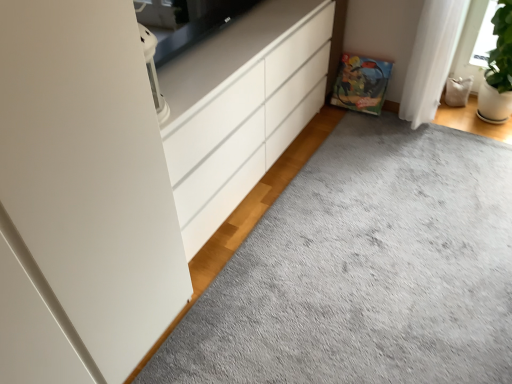
Measure the distance between white glossy chest of drawers at center and camera.

white glossy chest of drawers at center is 1.45 meters away from camera.

The height and width of the screenshot is (384, 512). What do you see at coordinates (241, 108) in the screenshot?
I see `white glossy chest of drawers at center` at bounding box center [241, 108].

Locate an element on the screen. white glossy chest of drawers at center is located at coordinates click(x=241, y=108).

What do you see at coordinates (290, 181) in the screenshot?
I see `gray soft carpet at center` at bounding box center [290, 181].

What is the approximate width of gray soft carpet at center?

gray soft carpet at center is 2.18 meters in width.

Identify the location of gray soft carpet at center. This screenshot has width=512, height=384. (290, 181).

Where is `white glossy chest of drawers at center`? The width and height of the screenshot is (512, 384). white glossy chest of drawers at center is located at coordinates (241, 108).

Based on the photo, which object is positioned more to the left, white glossy chest of drawers at center or gray soft carpet at center?

From the viewer's perspective, white glossy chest of drawers at center appears more on the left side.

Considering the relative positions of white glossy chest of drawers at center and gray soft carpet at center in the image provided, is white glossy chest of drawers at center behind gray soft carpet at center?

Yes, it is behind gray soft carpet at center.

Is point (198, 133) more distant than point (251, 199)?

No.

From the picture: From the image's perspective, which object appears higher, white glossy chest of drawers at center or gray soft carpet at center?

white glossy chest of drawers at center.

From a real-world perspective, is white glossy chest of drawers at center physically below gray soft carpet at center?

No, from a real-world perspective, white glossy chest of drawers at center is not under gray soft carpet at center.

Considering the sizes of objects white glossy chest of drawers at center and gray soft carpet at center in the image provided, who is thinner, white glossy chest of drawers at center or gray soft carpet at center?

white glossy chest of drawers at center.

Is white glossy chest of drawers at center shorter than gray soft carpet at center?

Incorrect, the height of white glossy chest of drawers at center does not fall short of that of gray soft carpet at center.

Which of these two, white glossy chest of drawers at center or gray soft carpet at center, is bigger?

Bigger between the two is white glossy chest of drawers at center.

Does white glossy chest of drawers at center contain gray soft carpet at center?

No, gray soft carpet at center is not surrounded by white glossy chest of drawers at center.

Is white glossy chest of drawers at center next to gray soft carpet at center and touching it?

No, white glossy chest of drawers at center is not with gray soft carpet at center.

Is white glossy chest of drawers at center aimed at gray soft carpet at center?

Yes, white glossy chest of drawers at center is turned towards gray soft carpet at center.

How many degrees apart are the facing directions of white glossy chest of drawers at center and gray soft carpet at center?

90.4 degrees.

The height and width of the screenshot is (384, 512). I want to click on plain located below the white glossy chest of drawers at center (from the image's perspective), so click(x=290, y=181).

Between gray soft carpet at center and white glossy chest of drawers at center, which one appears on the right side from the viewer's perspective?

Positioned to the right is gray soft carpet at center.

Does gray soft carpet at center come in front of white glossy chest of drawers at center?

Yes, gray soft carpet at center is closer to the camera.

Is point (410, 219) more distant than point (204, 81)?

Yes.

From the image's perspective, which one is positioned higher, gray soft carpet at center or white glossy chest of drawers at center?

From the image's view, white glossy chest of drawers at center is above.

From a real-world perspective, which object stands above the other?

white glossy chest of drawers at center, from a real-world perspective.

Is gray soft carpet at center thinner than white glossy chest of drawers at center?

In fact, gray soft carpet at center might be wider than white glossy chest of drawers at center.

Between gray soft carpet at center and white glossy chest of drawers at center, which one has more height?

white glossy chest of drawers at center.

Considering the sizes of objects gray soft carpet at center and white glossy chest of drawers at center in the image provided, who is smaller, gray soft carpet at center or white glossy chest of drawers at center?

Smaller between the two is gray soft carpet at center.

Could white glossy chest of drawers at center be considered to be inside gray soft carpet at center?

No, white glossy chest of drawers at center is located outside of gray soft carpet at center.

Are gray soft carpet at center and white glossy chest of drawers at center beside each other?

No, gray soft carpet at center is not making contact with white glossy chest of drawers at center.

Is gray soft carpet at center looking in the opposite direction of white glossy chest of drawers at center?

No, gray soft carpet at center is not facing away from white glossy chest of drawers at center.

How different are the orientations of gray soft carpet at center and white glossy chest of drawers at center in degrees?

They differ by 90.4 degrees in their facing directions.

Find the location of a particular element. This screenshot has height=384, width=512. the chest of drawers above the gray soft carpet at center (from a real-world perspective) is located at coordinates (241, 108).

Find the location of a particular element. The width and height of the screenshot is (512, 384). plain that is below the white glossy chest of drawers at center (from the image's perspective) is located at coordinates (290, 181).

At what (x,y) coordinates should I click in order to perform the action: click on plain on the right of white glossy chest of drawers at center. Please return your answer as a coordinate pair (x, y). The image size is (512, 384). Looking at the image, I should click on (290, 181).